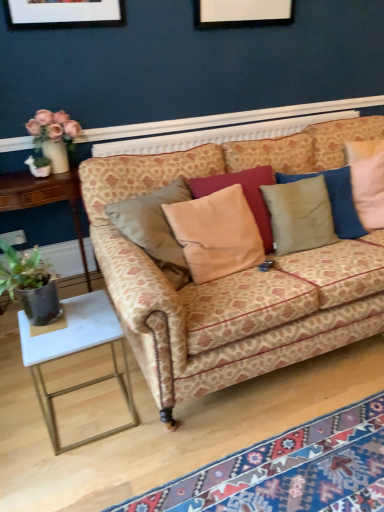
Question: Is the depth of beige fabric pillow at center, which appears as the first pillow when viewed from the left, less than that of carpet with geometric patterns at lower right?

Choices:
 (A) no
 (B) yes

Answer: (A)

Question: From a real-world perspective, is beige fabric pillow at center, which is counted as the 2th pillow, starting from the right, positioned under carpet with geometric patterns at lower right based on gravity?

Choices:
 (A) yes
 (B) no

Answer: (B)

Question: Does beige fabric pillow at center, which is counted as the 2th pillow, starting from the right, have a smaller size compared to carpet with geometric patterns at lower right?

Choices:
 (A) no
 (B) yes

Answer: (A)

Question: Can you confirm if beige fabric pillow at center, which appears as the first pillow when viewed from the left, is taller than carpet with geometric patterns at lower right?

Choices:
 (A) yes
 (B) no

Answer: (A)

Question: Does beige fabric pillow at center, which appears as the first pillow when viewed from the left, have a larger size compared to carpet with geometric patterns at lower right?

Choices:
 (A) yes
 (B) no

Answer: (A)

Question: From the image's perspective, would you say beige fabric pillow at center, which is counted as the 2th pillow, starting from the right, is shown under carpet with geometric patterns at lower right?

Choices:
 (A) yes
 (B) no

Answer: (B)

Question: Is beige fabric pillow at center, which is counted as the 2th pillow, starting from the right, shorter than velvet beige pillow at center, which appears as the first pillow when viewed from the right?

Choices:
 (A) no
 (B) yes

Answer: (A)

Question: From a real-world perspective, is beige fabric pillow at center, which appears as the first pillow when viewed from the left, over velvet beige pillow at center, which appears as the first pillow when viewed from the right?

Choices:
 (A) yes
 (B) no

Answer: (A)

Question: Would you say beige fabric pillow at center, which appears as the first pillow when viewed from the left, is a long distance from velvet beige pillow at center, which ranks as the second pillow in left-to-right order?

Choices:
 (A) yes
 (B) no

Answer: (B)

Question: From a real-world perspective, is beige fabric pillow at center, which appears as the first pillow when viewed from the left, below velvet beige pillow at center, which ranks as the second pillow in left-to-right order?

Choices:
 (A) yes
 (B) no

Answer: (B)

Question: Considering the relative sizes of beige fabric pillow at center, which is counted as the 2th pillow, starting from the right, and velvet beige pillow at center, which ranks as the second pillow in left-to-right order, in the image provided, is beige fabric pillow at center, which is counted as the 2th pillow, starting from the right, taller than velvet beige pillow at center, which ranks as the second pillow in left-to-right order,?

Choices:
 (A) no
 (B) yes

Answer: (B)

Question: Does beige fabric pillow at center, which appears as the first pillow when viewed from the left, appear on the right side of velvet beige pillow at center, which ranks as the second pillow in left-to-right order?

Choices:
 (A) yes
 (B) no

Answer: (B)

Question: Is patterned fabric couch at center completely or partially outside of carpet with geometric patterns at lower right?

Choices:
 (A) no
 (B) yes

Answer: (B)